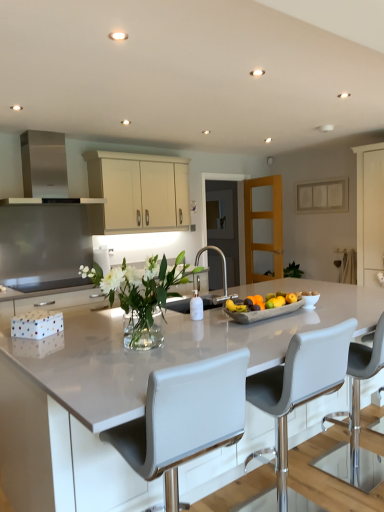
The image size is (384, 512). Find the location of `white glossy countertop at center`. white glossy countertop at center is located at coordinates (168, 348).

Describe the element at coordinates (233, 215) in the screenshot. I see `clear glass door at center, the 1th glass door when ordered from left to right` at that location.

Describe the element at coordinates (141, 295) in the screenshot. The height and width of the screenshot is (512, 384). I see `clear glass vase at center` at that location.

This screenshot has width=384, height=512. I want to click on clear glass vase at center, so click(141, 295).

This screenshot has width=384, height=512. Describe the element at coordinates (264, 312) in the screenshot. I see `concrete tray of fruits at center` at that location.

What is the approximate height of concrete tray of fruits at center?

concrete tray of fruits at center is 3.13 inches tall.

What do you see at coordinates (137, 191) in the screenshot?
I see `cream matte cabinet at upper center` at bounding box center [137, 191].

How much space does light brown wooden door at center, the 2th glass door positioned from the left, occupy vertically?

The height of light brown wooden door at center, the 2th glass door positioned from the left, is 1.50 meters.

This screenshot has height=512, width=384. What do you see at coordinates (300, 384) in the screenshot?
I see `white leather chair at center, which ranks as the first chair in right-to-left order` at bounding box center [300, 384].

I want to click on white glossy countertop at center, so click(168, 348).

Considering the relative sizes of stainless steel exhaust hood at upper left and clear glass vase at center in the image provided, is stainless steel exhaust hood at upper left shorter than clear glass vase at center?

Incorrect, the height of stainless steel exhaust hood at upper left does not fall short of that of clear glass vase at center.

Are stainless steel exhaust hood at upper left and clear glass vase at center beside each other?

stainless steel exhaust hood at upper left and clear glass vase at center are not in contact.

Is stainless steel exhaust hood at upper left behind clear glass vase at center?

Yes, it is behind clear glass vase at center.

Considering the sizes of objects stainless steel exhaust hood at upper left and clear glass vase at center in the image provided, who is wider, stainless steel exhaust hood at upper left or clear glass vase at center?

clear glass vase at center is wider.

Consider the image. Can you confirm if light brown wooden door at center, placed as the first glass door when sorted from right to left, is smaller than white leather chair at center, arranged as the 2th chair when viewed from the right?

Yes.

Can we say light brown wooden door at center, the 2th glass door positioned from the left, lies outside white leather chair at center, arranged as the 2th chair when viewed from the right?

Absolutely, light brown wooden door at center, the 2th glass door positioned from the left, is external to white leather chair at center, arranged as the 2th chair when viewed from the right.

Would you consider light brown wooden door at center, the 2th glass door positioned from the left, to be distant from white leather chair at center, placed as the first chair when sorted from left to right?

Yes, light brown wooden door at center, the 2th glass door positioned from the left, and white leather chair at center, placed as the first chair when sorted from left to right, are located far from each other.

Considering the positions of point (246, 200) and point (247, 357), is point (246, 200) closer or farther from the camera than point (247, 357)?

Clearly, point (246, 200) is more distant from the camera than point (247, 357).

Considering the relative sizes of white leather chair at center, placed as the first chair when sorted from left to right, and white glossy countertop at center in the image provided, is white leather chair at center, placed as the first chair when sorted from left to right, wider than white glossy countertop at center?

No.

From the picture: Could white glossy countertop at center be considered to be inside white leather chair at center, arranged as the 2th chair when viewed from the right?

No, white leather chair at center, arranged as the 2th chair when viewed from the right, does not contain white glossy countertop at center.

In the scene shown: Does white leather chair at center, placed as the first chair when sorted from left to right, appear on the left side of white glossy countertop at center?

Yes, white leather chair at center, placed as the first chair when sorted from left to right, is to the left of white glossy countertop at center.

Does point (185, 380) appear closer or farther from the camera than point (361, 309)?

Point (185, 380).

Between concrete tray of fruits at center and white leather chair at center, which ranks as the first chair in right-to-left order, which one appears on the left side from the viewer's perspective?

From the viewer's perspective, concrete tray of fruits at center appears more on the left side.

Is concrete tray of fruits at center not near white leather chair at center, positioned as the second chair in left-to-right order?

concrete tray of fruits at center is actually quite close to white leather chair at center, positioned as the second chair in left-to-right order.

You are a GUI agent. You are given a task and a screenshot of the screen. Output one action in this format:
    pyautogui.click(x=<x>, y=<y>)
    Task: Click on the fruit dish on the left of white leather chair at center, positioned as the second chair in left-to-right order
    
    Given the screenshot: What is the action you would take?
    pyautogui.click(x=264, y=312)

Based on the photo, considering the sizes of concrete tray of fruits at center and white leather chair at center, positioned as the second chair in left-to-right order, in the image, is concrete tray of fruits at center bigger or smaller than white leather chair at center, positioned as the second chair in left-to-right order,?

concrete tray of fruits at center is smaller than white leather chair at center, positioned as the second chair in left-to-right order.

Is stainless steel exhaust hood at upper left looking in the opposite direction of cream matte cabinet at upper center?

stainless steel exhaust hood at upper left is not turned away from cream matte cabinet at upper center.

Which of these two, stainless steel exhaust hood at upper left or cream matte cabinet at upper center, stands shorter?

stainless steel exhaust hood at upper left is shorter.

Are stainless steel exhaust hood at upper left and cream matte cabinet at upper center making contact?

A: No, stainless steel exhaust hood at upper left is not touching cream matte cabinet at upper center.

Is stainless steel exhaust hood at upper left bigger than cream matte cabinet at upper center?

Answer: No, stainless steel exhaust hood at upper left is not bigger than cream matte cabinet at upper center.

Who is bigger, cream matte cabinet at upper center or concrete tray of fruits at center?

cream matte cabinet at upper center.

From a real-world perspective, which object rests below the other?

concrete tray of fruits at center is physically lower.

Is cream matte cabinet at upper center closer to the viewer compared to concrete tray of fruits at center?

No, cream matte cabinet at upper center is further to the viewer.

Is concrete tray of fruits at center with cream matte cabinet at upper center?

No, concrete tray of fruits at center is not beside cream matte cabinet at upper center.

From a real-world perspective, between concrete tray of fruits at center and cream matte cabinet at upper center, who is vertically higher?

In real-world perspective, cream matte cabinet at upper center is above.

Does point (242, 322) come closer to viewer compared to point (142, 208)?

That is True.

Where is `floral arrangement below the stainless steel exhaust hood at upper left (from the image's perspective)`? Image resolution: width=384 pixels, height=512 pixels. floral arrangement below the stainless steel exhaust hood at upper left (from the image's perspective) is located at coordinates pyautogui.click(x=141, y=295).

Locate an element on the screen. the 2nd chair counting from the left side of the light brown wooden door at center, the 2th glass door positioned from the left is located at coordinates (184, 417).

Estimate the real-world distances between objects in this image. Which object is further from stainless steel exhaust hood at upper left, light brown wooden door at center, placed as the first glass door when sorted from right to left, or clear glass vase at center?

light brown wooden door at center, placed as the first glass door when sorted from right to left, is further to stainless steel exhaust hood at upper left.

When comparing their distances from concrete tray of fruits at center, does white leather chair at center, which ranks as the first chair in right-to-left order, or stainless steel exhaust hood at upper left seem further?

Based on the image, stainless steel exhaust hood at upper left appears to be further to concrete tray of fruits at center.

Based on the photo, looking at the image, which one is located closer to cream matte cabinet at upper center, clear glass door at center, which is counted as the second glass door, starting from the right, or stainless steel exhaust hood at upper left?

stainless steel exhaust hood at upper left is closer to cream matte cabinet at upper center.

Which object lies further to the anchor point clear glass door at center, the 1th glass door when ordered from left to right, clear glass vase at center or white leather chair at center, placed as the first chair when sorted from left to right?

The object further to clear glass door at center, the 1th glass door when ordered from left to right, is white leather chair at center, placed as the first chair when sorted from left to right.

Looking at the image, which one is located further to white leather chair at center, arranged as the 2th chair when viewed from the right, clear glass door at center, which is counted as the second glass door, starting from the right, or cream matte cabinet at upper center?

clear glass door at center, which is counted as the second glass door, starting from the right, lies further to white leather chair at center, arranged as the 2th chair when viewed from the right, than the other object.

Looking at the image, which one is located further to white leather chair at center, arranged as the 2th chair when viewed from the right, concrete tray of fruits at center or white leather chair at center, which ranks as the first chair in right-to-left order?

concrete tray of fruits at center.

Based on their spatial positions, is cream matte cabinet at upper center or light brown wooden door at center, the 2th glass door positioned from the left, further from concrete tray of fruits at center?

light brown wooden door at center, the 2th glass door positioned from the left, is positioned further to the anchor concrete tray of fruits at center.

Considering their positions, is stainless steel exhaust hood at upper left positioned closer to concrete tray of fruits at center than white glossy countertop at center?

white glossy countertop at center is closer to concrete tray of fruits at center.

Identify the location of fruit dish between white leather chair at center, arranged as the 2th chair when viewed from the right, and cream matte cabinet at upper center in the front-back direction. This screenshot has height=512, width=384. (264, 312).

Identify the location of floral arrangement between white leather chair at center, placed as the first chair when sorted from left to right, and clear glass door at center, which is counted as the second glass door, starting from the right, in the front-back direction. (141, 295).

Locate an element on the screen. This screenshot has height=512, width=384. floral arrangement positioned between white glossy countertop at center and light brown wooden door at center, the 2th glass door positioned from the left, from near to far is located at coordinates (141, 295).

Find the location of a particular element. This screenshot has width=384, height=512. cabinetry located between white leather chair at center, arranged as the 2th chair when viewed from the right, and clear glass door at center, which is counted as the second glass door, starting from the right, in the depth direction is located at coordinates (137, 191).